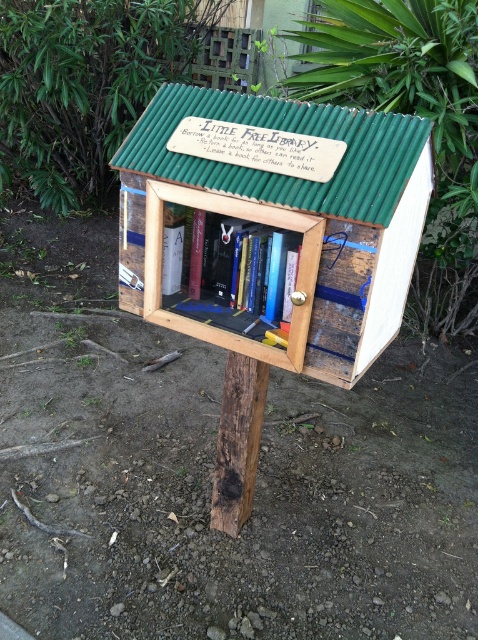
Does wooden bookshelf at center have a greater height compared to hardcover book at center?

Yes.

In order to click on wooden bookshelf at center in this screenshot , I will do `click(274, 221)`.